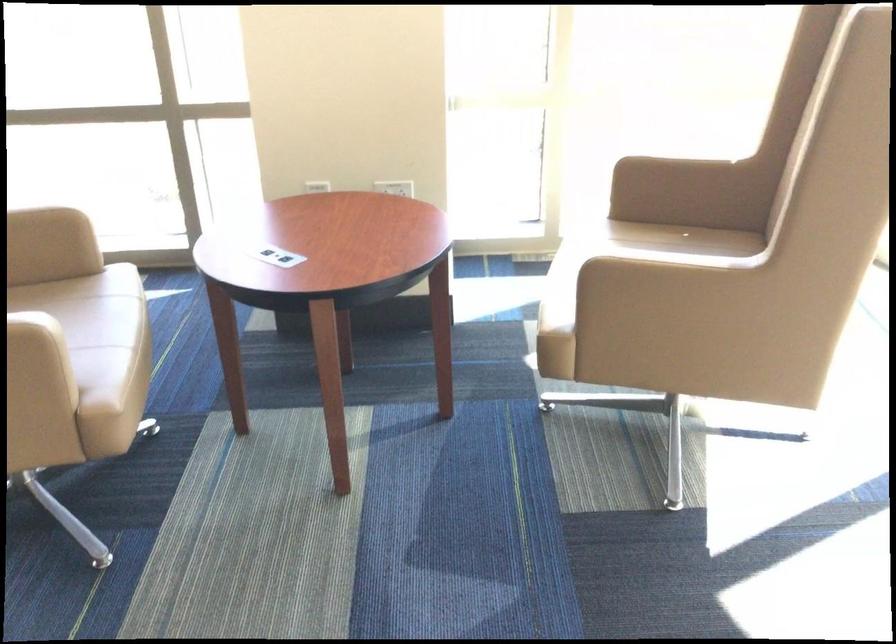
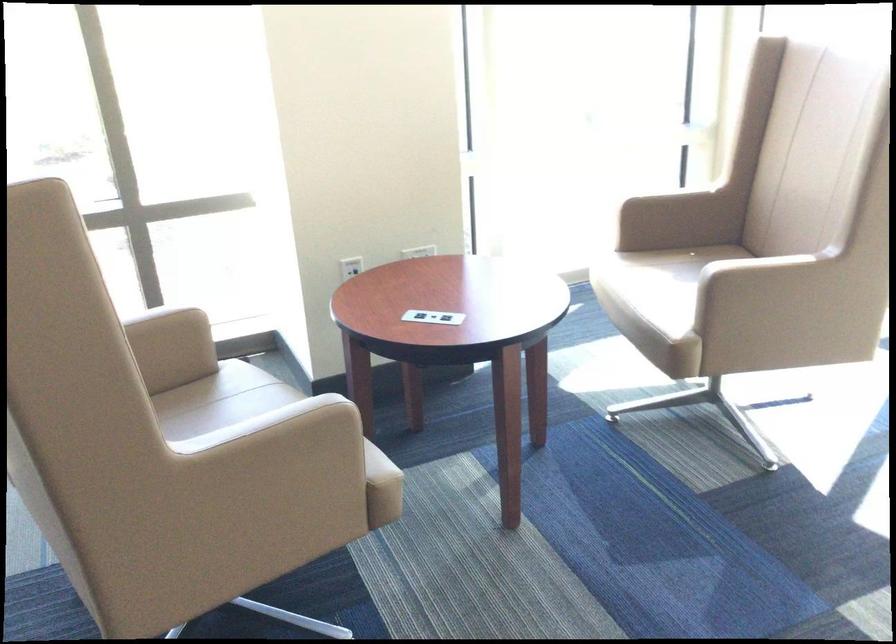
Locate, in the second image, the point that corresponds to pixel 313 189 in the first image.

(350, 267)